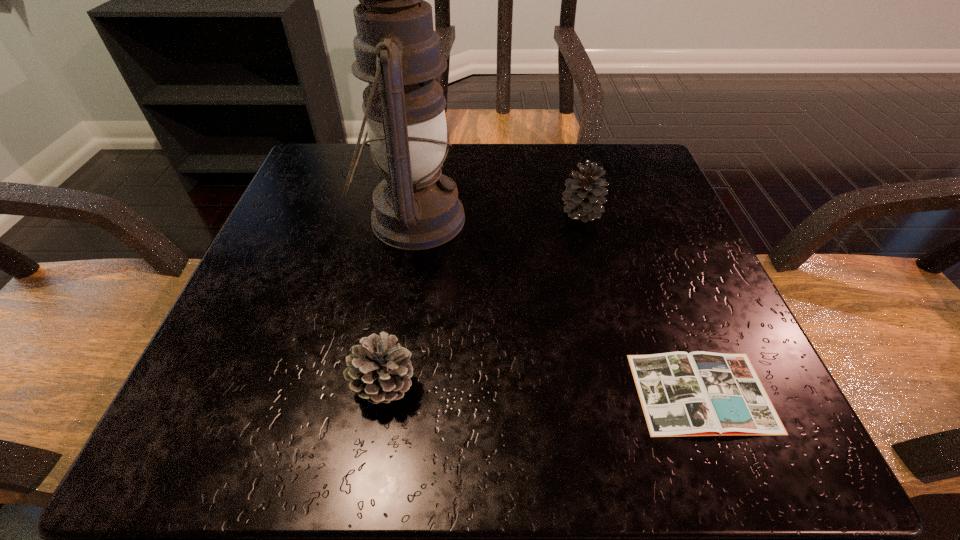
Find the location of a particular element. The image size is (960, 540). free space between the oil lamp and the shortest object is located at coordinates (558, 306).

You are a GUI agent. You are given a task and a screenshot of the screen. Output one action in this format:
    pyautogui.click(x=<x>, y=<y>)
    Task: Click on the free space between the taller pinecone and the tallest object
    The height and width of the screenshot is (540, 960).
    Given the screenshot: What is the action you would take?
    pyautogui.click(x=497, y=216)

The width and height of the screenshot is (960, 540). Find the location of `vacant area that lies between the oil lamp and the third shortest object`. vacant area that lies between the oil lamp and the third shortest object is located at coordinates (497, 216).

Image resolution: width=960 pixels, height=540 pixels. I want to click on vacant space in between the right pinecone and the oil lamp, so coord(497,216).

Where is `free point between the nearer pinecone and the right pinecone`? The height and width of the screenshot is (540, 960). free point between the nearer pinecone and the right pinecone is located at coordinates (483, 299).

This screenshot has width=960, height=540. I want to click on blank region between the third tallest object and the tallest object, so click(x=398, y=302).

At what (x,y) coordinates should I click in order to perform the action: click on vacant area that lies between the nearer pinecone and the oil lamp. Please return your answer as a coordinate pair (x, y). Looking at the image, I should click on (398, 302).

Locate an element on the screen. The width and height of the screenshot is (960, 540). object that is the second closest to the oil lamp is located at coordinates (584, 196).

Locate which object is the third closest to the farther pinecone. Please provide its 2D coordinates. Your answer should be formatted as a tuple, i.e. [(x, y)], where the tuple contains the x and y coordinates of a point satisfying the conditions above.

[(380, 372)]

Locate an element on the screen. This screenshot has width=960, height=540. vacant region that satisfies the following two spatial constraints: 1. on the back side of the left pinecone; 2. on the right side of the third shortest object is located at coordinates (413, 213).